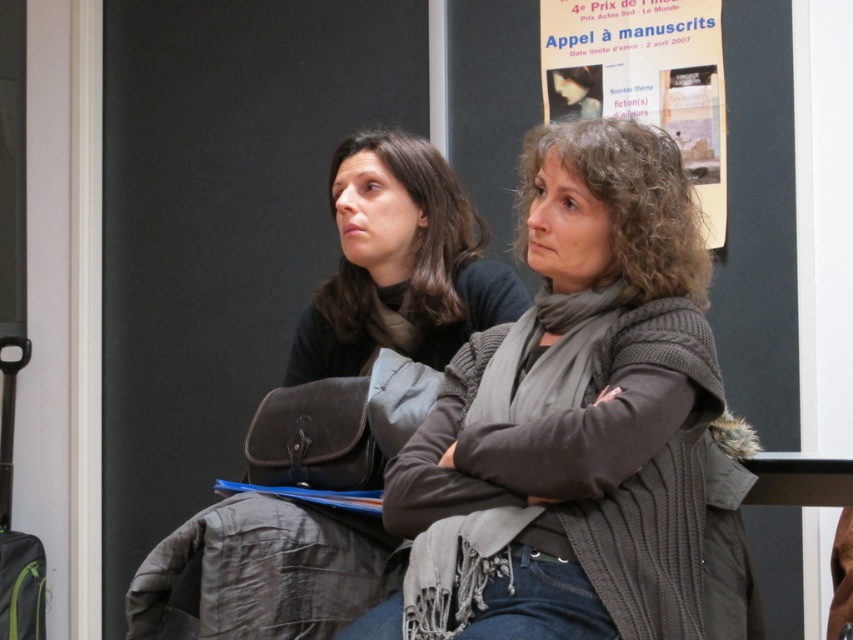
You are a photographer adjusting your camera settings to focus on two specific points in the image. The points are labeled as point (485, 291) and point (569, 84). Since you want to ensure both points are in focus, which point should you prioritize focusing on first to account for depth of field?

Point (485, 291) is closer to the camera than point (569, 84), so you should focus on point (485, 291) first to ensure both points are within the depth of field.

You are an assistant helping to organize a clothing store. You have two items in front of you, the knitted gray sweater at center and the matte black jacket at center. Which one should be placed on the higher shelf if the store policy requires taller items to be placed on higher shelves?

The knitted gray sweater at center is taller than the matte black jacket at center, so it should be placed on the higher shelf according to the store policy.

You are an assistant who needs to identify the exact location of a specific point in the image. The point is located at coordinates point (x=583, y=404). Based on the scene description, can you determine which object this point is on?

The point (x=583, y=404) is on the knitted gray sweater at center.